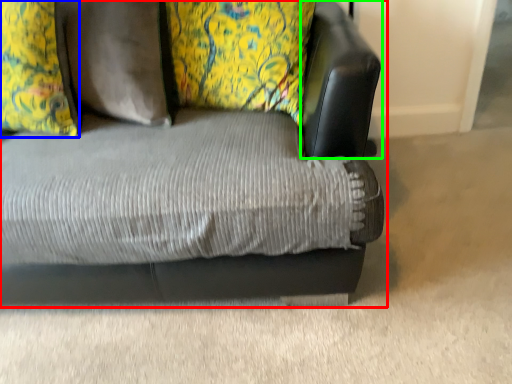
Question: Considering the real-world distances, which object is farthest from studio couch (highlighted by a red box)? pillow (highlighted by a blue box) or swivel chair (highlighted by a green box)?

Choices:
 (A) pillow
 (B) swivel chair

Answer: (A)